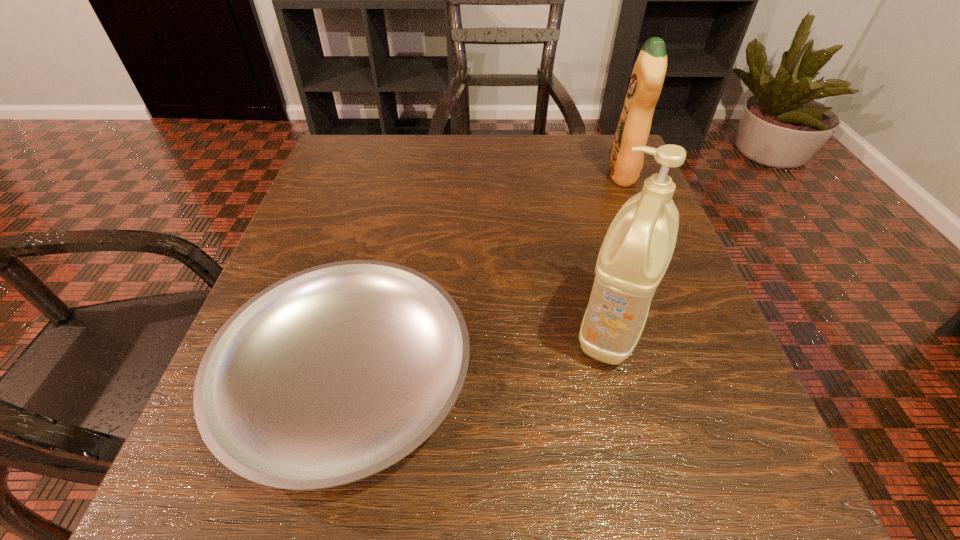
At what (x,y) coordinates should I click in order to perform the action: click on vacant space located 0.350m on the back of the shortest object. Please return your answer as a coordinate pair (x, y). Looking at the image, I should click on (397, 173).

Identify the location of object at the far edge. (648, 75).

The width and height of the screenshot is (960, 540). In order to click on object present at the near edge in this screenshot , I will do `click(330, 375)`.

Locate an element on the screen. object at the left edge is located at coordinates (330, 375).

I want to click on object that is at the near left corner, so click(330, 375).

Where is `object that is at the far right corner`? object that is at the far right corner is located at coordinates (648, 75).

The image size is (960, 540). In the image, there is a desktop. Identify the location of free space at the far edge. (472, 170).

You are a GUI agent. You are given a task and a screenshot of the screen. Output one action in this format:
    pyautogui.click(x=<x>, y=<y>)
    Task: Click on the vacant space at the near edge of the desktop
    The width and height of the screenshot is (960, 540).
    Given the screenshot: What is the action you would take?
    pyautogui.click(x=505, y=496)

In the image, there is a desktop. Where is `free space at the left edge`? free space at the left edge is located at coordinates (322, 241).

Where is `vacant space at the right edge of the desktop`? Image resolution: width=960 pixels, height=540 pixels. vacant space at the right edge of the desktop is located at coordinates point(621,199).